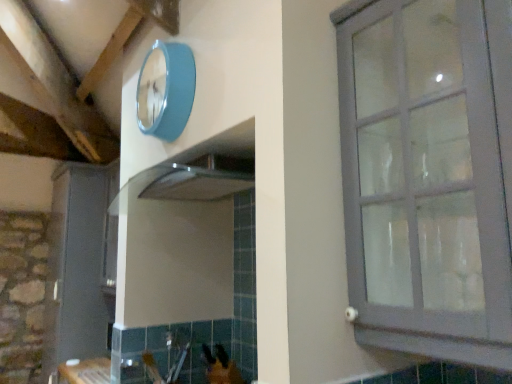
Describe the element at coordinates (77, 266) in the screenshot. I see `matte gray cabinet at left` at that location.

Where is `matte gray cabinet at right`? The image size is (512, 384). matte gray cabinet at right is located at coordinates (426, 175).

At what (x,y) coordinates should I click in order to perform the action: click on window below the teal glossy clock at upper center (from the image's perspective). Please return your answer as a coordinate pair (x, y). Looking at the image, I should click on (426, 175).

Which object is more forward, teal glossy clock at upper center or matte gray cabinet at right?

matte gray cabinet at right is more forward.

Does point (160, 80) lie behind point (485, 96)?

Yes, it is.

Is teal glossy clock at upper center taller than matte gray cabinet at right?

In fact, teal glossy clock at upper center may be shorter than matte gray cabinet at right.

In the scene shown: Is matte gray cabinet at right not near teal glossy clock at upper center?

No, matte gray cabinet at right is not far away from teal glossy clock at upper center.

Which of these two, matte gray cabinet at right or teal glossy clock at upper center, stands taller?

matte gray cabinet at right is taller.

Measure the distance between matte gray cabinet at right and teal glossy clock at upper center.

They are 29.69 inches apart.

Is matte gray cabinet at right in front of or behind teal glossy clock at upper center in the image?

In the image, matte gray cabinet at right appears in front of teal glossy clock at upper center.

In the image, is matte gray cabinet at right on the left side or the right side of matte gray cabinet at left?

From the image, it's evident that matte gray cabinet at right is to the right of matte gray cabinet at left.

Is matte gray cabinet at right oriented towards matte gray cabinet at left?

No.

Locate an element on the screen. This screenshot has width=512, height=384. window above the matte gray cabinet at left (from the image's perspective) is located at coordinates (426, 175).

Find the location of a particular element. screen door behind the teal glossy clock at upper center is located at coordinates (77, 266).

Is teal glossy clock at upper center turned away from matte gray cabinet at left?

No.

Which is farther from the camera, (x=170, y=138) or (x=83, y=338)?

The point (x=83, y=338) is farther.

Which is in front, teal glossy clock at upper center or matte gray cabinet at left?

teal glossy clock at upper center is more forward.

In the image, is matte gray cabinet at left on the left side or the right side of matte gray cabinet at right?

In the image, matte gray cabinet at left appears on the left side of matte gray cabinet at right.

From a real-world perspective, is matte gray cabinet at left below matte gray cabinet at right?

Yes, from a real-world perspective, matte gray cabinet at left is below matte gray cabinet at right.

In the scene shown: How many degrees apart are the facing directions of matte gray cabinet at left and matte gray cabinet at right?

The angular difference between matte gray cabinet at left and matte gray cabinet at right is 0.497 degrees.

Is point (89, 271) positioned after point (499, 172)?

Yes, it is behind point (499, 172).

Does matte gray cabinet at left have a lesser height compared to teal glossy clock at upper center?

Incorrect, the height of matte gray cabinet at left does not fall short of that of teal glossy clock at upper center.

Is matte gray cabinet at left facing towards teal glossy clock at upper center?

No, matte gray cabinet at left is not aimed at teal glossy clock at upper center.

How many degrees apart are the facing directions of matte gray cabinet at left and teal glossy clock at upper center?

0.977 degrees.

Who is smaller, matte gray cabinet at left or teal glossy clock at upper center?

teal glossy clock at upper center.

Locate an element on the screen. This screenshot has width=512, height=384. window below the teal glossy clock at upper center (from the image's perspective) is located at coordinates (426, 175).

Locate an element on the screen. Image resolution: width=512 pixels, height=384 pixels. clock located on the left of matte gray cabinet at right is located at coordinates (166, 90).

Based on their spatial positions, is matte gray cabinet at right or teal glossy clock at upper center closer to matte gray cabinet at left?

teal glossy clock at upper center.

Based on their spatial positions, is matte gray cabinet at right or matte gray cabinet at left further from teal glossy clock at upper center?

matte gray cabinet at left.

Estimate the real-world distances between objects in this image. Which object is closer to matte gray cabinet at right, teal glossy clock at upper center or matte gray cabinet at left?

Based on the image, teal glossy clock at upper center appears to be nearer to matte gray cabinet at right.

Considering their positions, is matte gray cabinet at left positioned further to matte gray cabinet at right than teal glossy clock at upper center?

Based on the image, matte gray cabinet at left appears to be further to matte gray cabinet at right.

Considering their positions, is teal glossy clock at upper center positioned further to matte gray cabinet at left than matte gray cabinet at right?

Among the two, matte gray cabinet at right is located further to matte gray cabinet at left.

When comparing their distances from teal glossy clock at upper center, does matte gray cabinet at left or matte gray cabinet at right seem further?

Based on the image, matte gray cabinet at left appears to be further to teal glossy clock at upper center.

Where is `clock between matte gray cabinet at right and matte gray cabinet at left along the z-axis`? The height and width of the screenshot is (384, 512). clock between matte gray cabinet at right and matte gray cabinet at left along the z-axis is located at coordinates (166, 90).